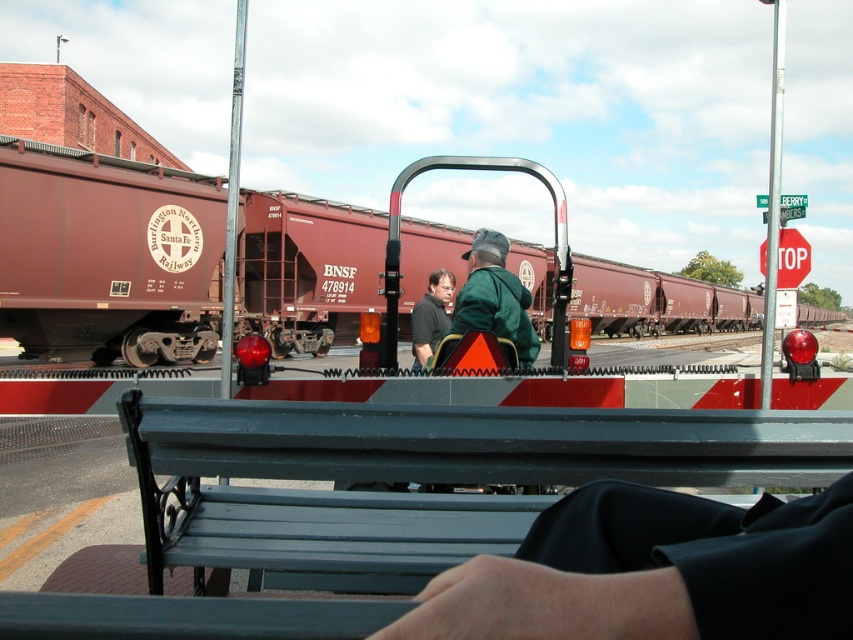
Where is `metallic gray bench at center`? The height and width of the screenshot is (640, 853). metallic gray bench at center is located at coordinates (419, 477).

Is the position of metallic gray bench at center more distant than that of maroon matte freight car at center?

No, metallic gray bench at center is closer to the viewer.

Is point (788, 440) farther from camera compared to point (300, 257)?

No, it is in front of (300, 257).

The width and height of the screenshot is (853, 640). In order to click on metallic gray bench at center in this screenshot , I will do `click(419, 477)`.

What do you see at coordinates (654, 572) in the screenshot? I see `dark green fabric at center` at bounding box center [654, 572].

Can you confirm if dark green fabric at center is bigger than matte black shirt at center?

Indeed, dark green fabric at center has a larger size compared to matte black shirt at center.

This screenshot has height=640, width=853. In order to click on dark green fabric at center in this screenshot , I will do `click(654, 572)`.

Can you confirm if metallic gray bench at center is positioned to the left of red plastic stop sign at upper right?

Yes, metallic gray bench at center is to the left of red plastic stop sign at upper right.

Between metallic gray bench at center and red plastic stop sign at upper right, which one has less height?

metallic gray bench at center is shorter.

Locate an element on the screen. This screenshot has width=853, height=640. metallic gray bench at center is located at coordinates (419, 477).

Locate an element on the screen. metallic gray bench at center is located at coordinates [x=419, y=477].